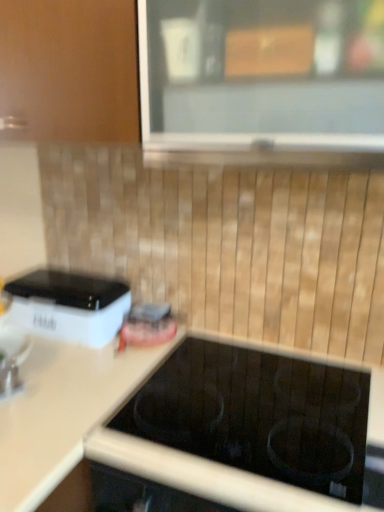
At what (x,y) coordinates should I click in order to perform the action: click on vacant space behind metallic faucet at lower left. Please return your answer as a coordinate pair (x, y). This screenshot has height=512, width=384. Looking at the image, I should click on (47, 356).